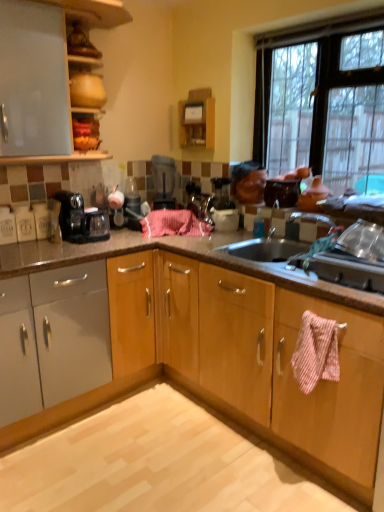
Question: Is pink striped towel at lower right, the first blanket in the front-to-back sequence, further to the viewer compared to black plastic coffee maker at left?

Choices:
 (A) no
 (B) yes

Answer: (A)

Question: From a real-world perspective, is pink striped towel at lower right, which is the 2th blanket from top to bottom, over black plastic coffee maker at left?

Choices:
 (A) yes
 (B) no

Answer: (B)

Question: From the image's perspective, is pink striped towel at lower right, acting as the 1th blanket starting from the right, under black plastic coffee maker at left?

Choices:
 (A) yes
 (B) no

Answer: (A)

Question: Is pink striped towel at lower right, the first blanket in the front-to-back sequence, touching black plastic coffee maker at left?

Choices:
 (A) no
 (B) yes

Answer: (A)

Question: Is pink striped towel at lower right, marked as the second blanket in a back-to-front arrangement, facing towards black plastic coffee maker at left?

Choices:
 (A) yes
 (B) no

Answer: (B)

Question: Can you confirm if pink striped towel at lower right, the first blanket in the front-to-back sequence, is taller than black plastic coffee maker at left?

Choices:
 (A) yes
 (B) no

Answer: (A)

Question: Does black plastic blender at center appear on the right side of pink striped towel at lower right, placed as the second blanket when sorted from left to right?

Choices:
 (A) yes
 (B) no

Answer: (B)

Question: Can you confirm if black plastic blender at center is bigger than pink striped towel at lower right, which is the 2th blanket from top to bottom?

Choices:
 (A) no
 (B) yes

Answer: (B)

Question: From the image's perspective, is black plastic blender at center located beneath pink striped towel at lower right, marked as the second blanket in a back-to-front arrangement?

Choices:
 (A) no
 (B) yes

Answer: (A)

Question: Does black plastic blender at center touch pink striped towel at lower right, placed as the second blanket when sorted from left to right?

Choices:
 (A) yes
 (B) no

Answer: (B)

Question: Are black plastic blender at center and pink striped towel at lower right, marked as the second blanket in a back-to-front arrangement, located far from each other?

Choices:
 (A) no
 (B) yes

Answer: (B)

Question: From a real-world perspective, is black plastic blender at center located higher than pink striped towel at lower right, which is the 2th blanket from top to bottom?

Choices:
 (A) no
 (B) yes

Answer: (B)

Question: Is metallic silver sink at right further to camera compared to black plastic blender at center?

Choices:
 (A) no
 (B) yes

Answer: (A)